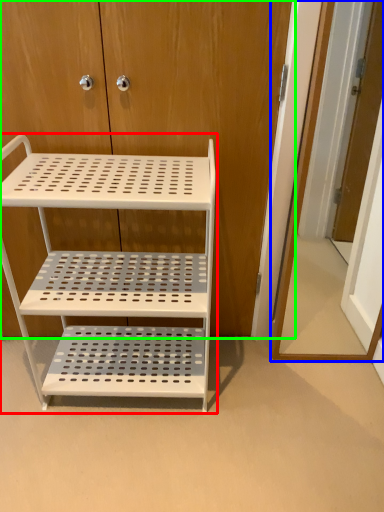
Question: Which object is positioned closest to shelf (highlighted by a red box)? Select from door (highlighted by a blue box) and dresser (highlighted by a green box).

Choices:
 (A) door
 (B) dresser

Answer: (B)